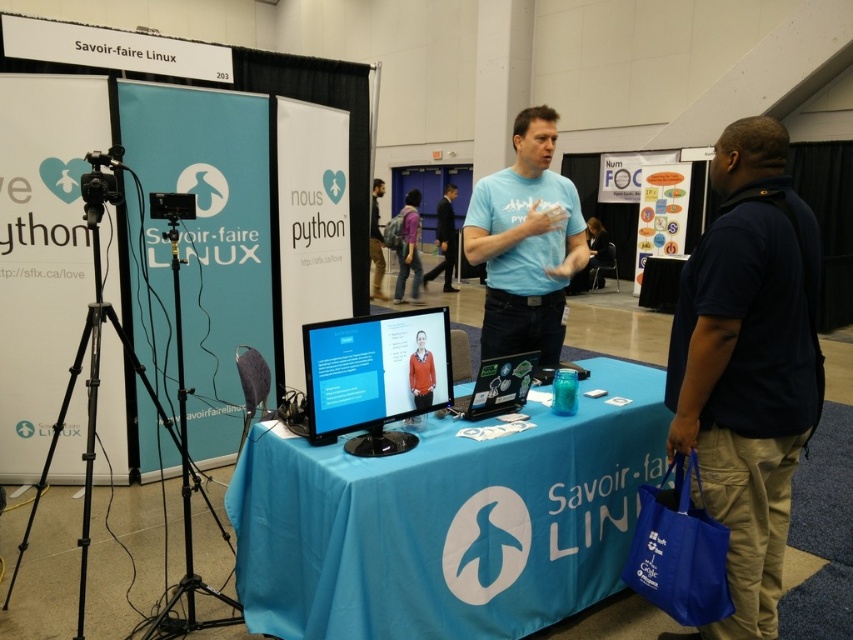
Consider the image. Is light blue t-shirt at center below light blue shirt at center?

Yes, light blue t-shirt at center is below light blue shirt at center.

Who is higher up, light blue t-shirt at center or light blue shirt at center?

Positioned higher is light blue shirt at center.

Between point (532, 294) and point (373, 218), which one is positioned behind?

The point (373, 218) is behind.

The image size is (853, 640). In order to click on light blue t-shirt at center in this screenshot , I will do `click(525, 243)`.

Is blue fabric table at center further to the viewer compared to blue t-shirt at center?

No, blue fabric table at center is in front of blue t-shirt at center.

Can you confirm if blue fabric table at center is bigger than blue t-shirt at center?

Correct, blue fabric table at center is larger in size than blue t-shirt at center.

This screenshot has width=853, height=640. In order to click on blue fabric table at center in this screenshot , I will do `click(448, 518)`.

Is matte black monitor at center positioned behind matte black laptop at center?

No, matte black monitor at center is in front of matte black laptop at center.

Who is more distant from viewer, (372, 362) or (482, 406)?

Point (482, 406)

This screenshot has height=640, width=853. What do you see at coordinates (375, 376) in the screenshot?
I see `matte black monitor at center` at bounding box center [375, 376].

Locate an element on the screen. This screenshot has width=853, height=640. matte black monitor at center is located at coordinates (375, 376).